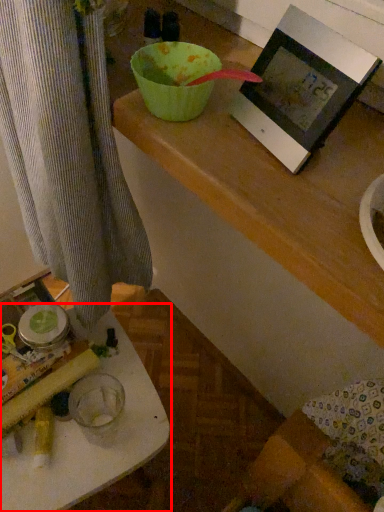
Question: Where is table (annotated by the red box) located in relation to picture frame in the image?

Choices:
 (A) left
 (B) right

Answer: (A)